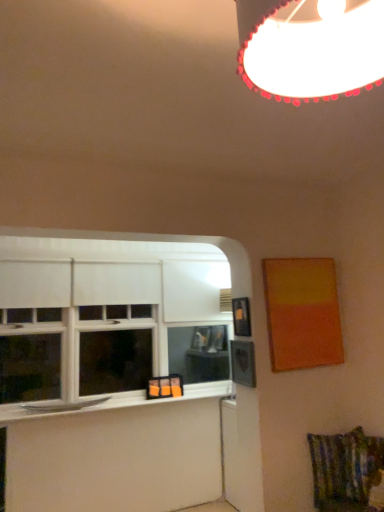
Question: Which direction should I rotate to look at textured multicolored fabric swivel chair at lower right?

Choices:
 (A) left
 (B) right

Answer: (B)

Question: Is textured multicolored fabric swivel chair at lower right wider than black plastic picture frame at upper right, placed as the first picture frame when sorted from left to right?

Choices:
 (A) no
 (B) yes

Answer: (B)

Question: Is textured multicolored fabric swivel chair at lower right to the left of black plastic picture frame at upper right, placed as the first picture frame when sorted from left to right, from the viewer's perspective?

Choices:
 (A) no
 (B) yes

Answer: (A)

Question: Does textured multicolored fabric swivel chair at lower right have a greater height compared to black plastic picture frame at upper right, the second picture frame viewed from the right?

Choices:
 (A) yes
 (B) no

Answer: (A)

Question: From a real-world perspective, does textured multicolored fabric swivel chair at lower right stand above black plastic picture frame at upper right, the second picture frame viewed from the right?

Choices:
 (A) yes
 (B) no

Answer: (B)

Question: Does textured multicolored fabric swivel chair at lower right have a smaller size compared to black plastic picture frame at upper right, the second picture frame viewed from the right?

Choices:
 (A) no
 (B) yes

Answer: (A)

Question: Does textured multicolored fabric swivel chair at lower right come behind black plastic picture frame at upper right, placed as the first picture frame when sorted from left to right?

Choices:
 (A) yes
 (B) no

Answer: (B)

Question: From the image's perspective, would you say black plastic picture frame at upper right, placed as the first picture frame when sorted from left to right, is shown under white glossy window sill at lower left?

Choices:
 (A) yes
 (B) no

Answer: (B)

Question: Is black plastic picture frame at upper right, placed as the first picture frame when sorted from left to right, positioned behind white glossy window sill at lower left?

Choices:
 (A) yes
 (B) no

Answer: (B)

Question: Considering the relative sizes of black plastic picture frame at upper right, placed as the first picture frame when sorted from left to right, and white glossy window sill at lower left in the image provided, is black plastic picture frame at upper right, placed as the first picture frame when sorted from left to right, thinner than white glossy window sill at lower left?

Choices:
 (A) no
 (B) yes

Answer: (B)

Question: Is black plastic picture frame at upper right, placed as the first picture frame when sorted from left to right, outside of white glossy window sill at lower left?

Choices:
 (A) no
 (B) yes

Answer: (B)

Question: Can you confirm if black plastic picture frame at upper right, placed as the first picture frame when sorted from left to right, is smaller than white glossy window sill at lower left?

Choices:
 (A) yes
 (B) no

Answer: (A)

Question: From a real-world perspective, does black plastic picture frame at upper right, the second picture frame viewed from the right, stand above white glossy window sill at lower left?

Choices:
 (A) yes
 (B) no

Answer: (A)

Question: From a real-world perspective, is white glossy window sill at lower left under textured multicolored fabric swivel chair at lower right?

Choices:
 (A) yes
 (B) no

Answer: (B)